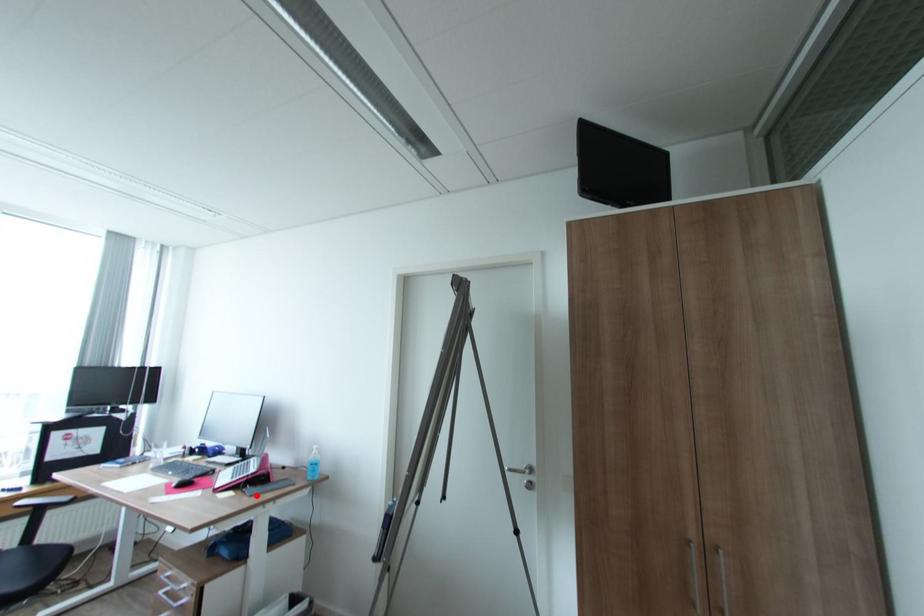
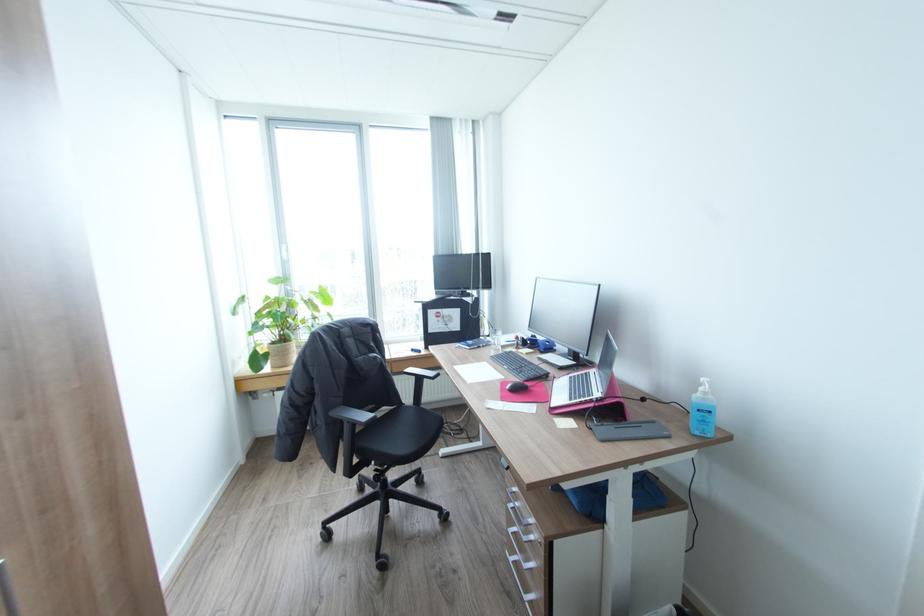
Where in the second image is the point corresponding to the highlighted location from the first image?

(608, 440)